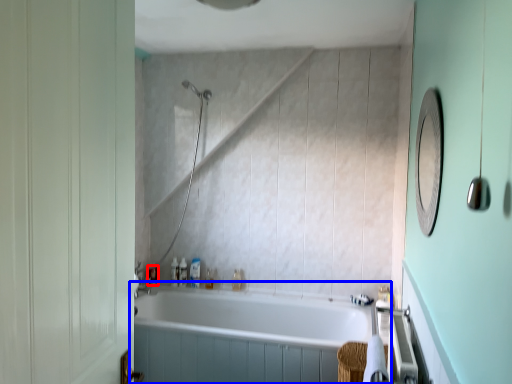
Question: Which of the following is the farthest to the observer, toiletry (highlighted by a red box) or bathtub (highlighted by a blue box)?

Choices:
 (A) toiletry
 (B) bathtub

Answer: (A)